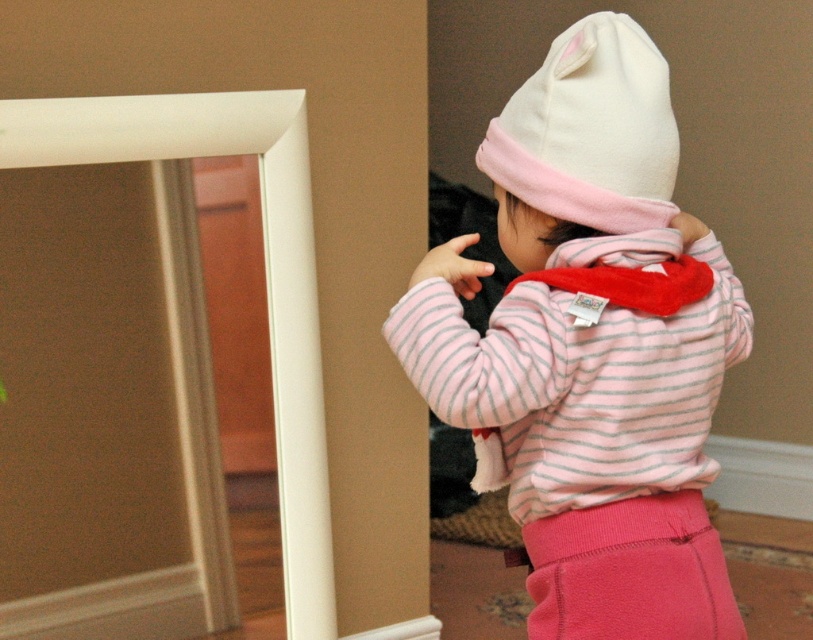
From the picture: You are a photographer in the room and want to take a photo of the child and the two fleece hats. Since the white fleece hat at upper right and the pink fleece hat at upper right are both in the scene, which one would appear closer to the camera in the photo?

The pink fleece hat at upper right would appear closer to the camera because the white fleece hat at upper right is behind it.

You are a photographer trying to capture the child in the scene. Since the white fleece hat at upper right and the pink fleece pants at lower right are both in view, which one is closer to the camera?

The white fleece hat at upper right is closer to the camera because it is in front of the pink fleece pants at lower right.